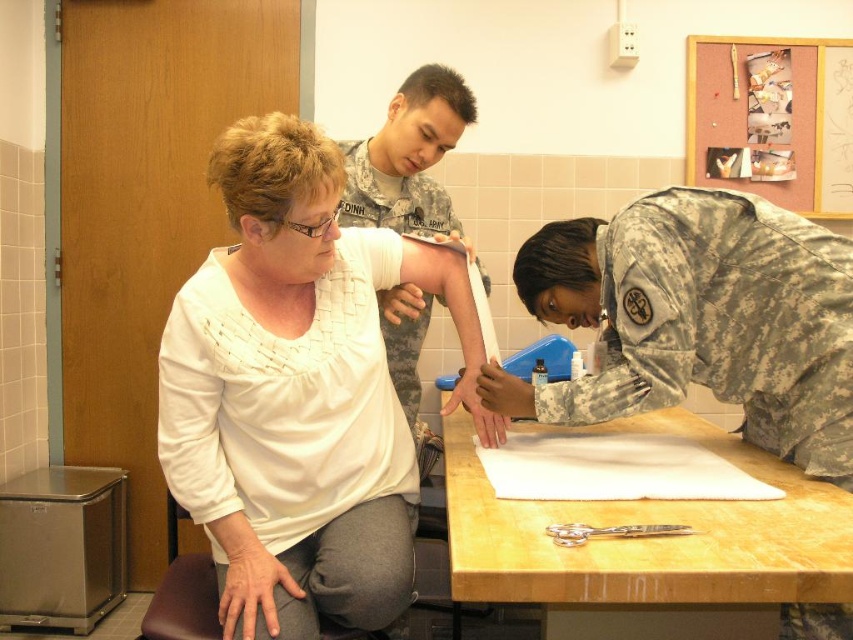
Is white textured shirt at center taller than wooden table at center?

Correct, white textured shirt at center is much taller as wooden table at center.

Between point (323, 252) and point (621, 502), which one is positioned in front?

Point (621, 502)

Where is `white textured shirt at center`? white textured shirt at center is located at coordinates (300, 392).

Is white textured shirt at center closer to the viewer compared to camouflage fabric uniform at lower right?

Yes, white textured shirt at center is in front of camouflage fabric uniform at lower right.

Between white textured shirt at center and camouflage fabric uniform at lower right, which one is positioned lower?

Positioned lower is white textured shirt at center.

Where is `white textured shirt at center`? white textured shirt at center is located at coordinates (300, 392).

Does camouflage fabric uniform at lower right have a greater width compared to camouflage fabric uniform at upper center?

Yes.

Does camouflage fabric uniform at lower right have a greater height compared to camouflage fabric uniform at upper center?

Incorrect, camouflage fabric uniform at lower right's height is not larger of camouflage fabric uniform at upper center's.

Which is in front, point (637, 408) or point (442, 204)?

Point (637, 408) is more forward.

Find the location of `camouflage fabric uniform at lower right`. camouflage fabric uniform at lower right is located at coordinates (705, 317).